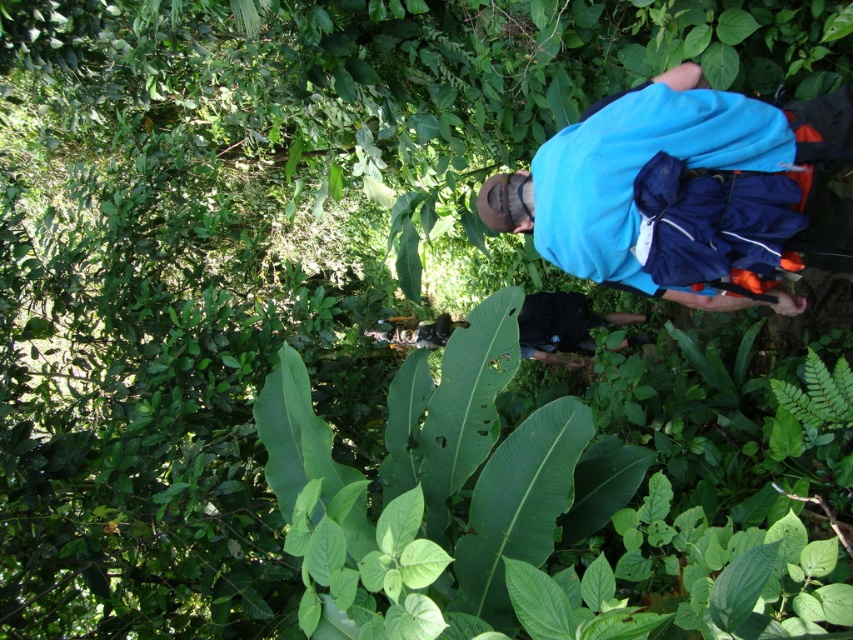
You are a hiker trying to determine which backpack is visible on top. Based on the scene, which backpack is on top between the blue fabric backpack at center and the black fabric backpack at center?

The blue fabric backpack at center is positioned over the black fabric backpack at center, so the blue fabric backpack at center is on top.

You are a hiker who wants to know which backpack is on the left side between the blue fabric backpack at center and the black fabric backpack at center. Can you tell me?

The blue fabric backpack at center is positioned on the left side of black fabric backpack at center.

You are a hiker navigating through a lush forest. You need to place a marker exactly at the center of the image to mark a trailhead. The blue fabric backpack at center is currently at coordinates point 0.300, 0.803. Is the backpack positioned to the left or right of the image center?

The blue fabric backpack at center is located at point (683, 192). Since the image center is at coordinates (426, 320), the backpack is positioned to the left of the image center because its x coordinate is less than 0.5.